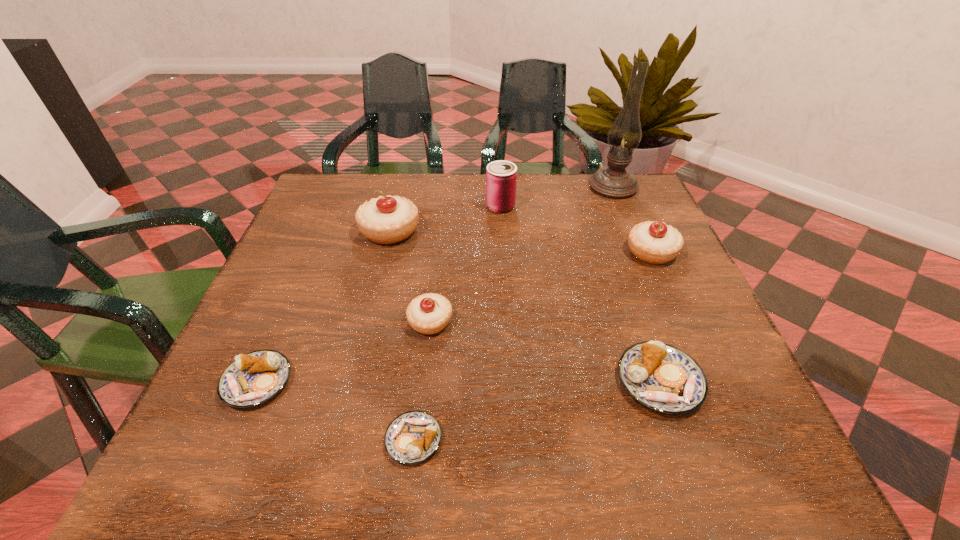
This screenshot has width=960, height=540. I want to click on the third shortest object, so click(663, 378).

Image resolution: width=960 pixels, height=540 pixels. What are the coordinates of `the rightmost brown pastry` in the screenshot? It's located at (663, 378).

Image resolution: width=960 pixels, height=540 pixels. In order to click on the second smallest brown pastry in this screenshot , I will do `click(252, 379)`.

Where is `the leftmost object`? The image size is (960, 540). the leftmost object is located at coordinates (252, 379).

The width and height of the screenshot is (960, 540). I want to click on the shortest object, so click(x=413, y=437).

Where is `the second brown pastry from left to right`? This screenshot has width=960, height=540. the second brown pastry from left to right is located at coordinates (413, 437).

Where is `vacant space located on the front of the tallest object`? vacant space located on the front of the tallest object is located at coordinates (633, 233).

I want to click on blank space located 0.330m on the right of the can, so click(638, 206).

Identify the location of vacant area located 0.400m on the front of the biggest beige pastry. This screenshot has width=960, height=540. (348, 398).

Identify the location of vacant region located 0.200m on the back of the rightmost beige pastry. This screenshot has height=540, width=960. (625, 192).